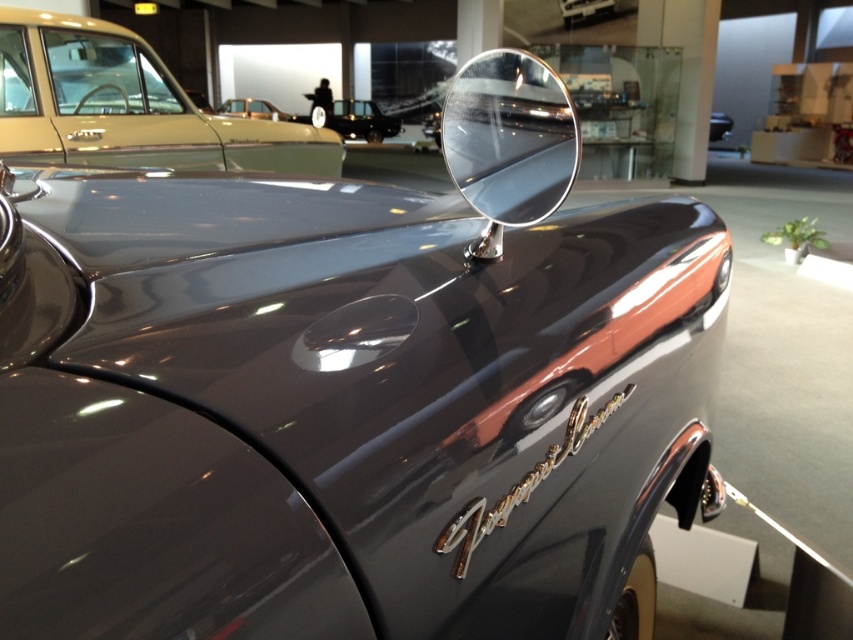
You are a photographer trying to capture both the shiny gold car at upper left and the shiny black car at center in a single frame. Which car should you adjust your camera angle to focus on first to ensure both are in view?

The shiny gold car at upper left is positioned under the shiny black car at center, so you should focus on the shiny black car at center first to ensure both are in view.

In the scene shown: You are a parking attendant who needs to move a car that is 2.5 meters long. You see the shiny gold car at upper left and the gold metallic car at upper center in the parking lot. Can you fit the car between them without moving either vehicle?

The distance between the shiny gold car at upper left and the gold metallic car at upper center is 2.70 meters. Since the car to be parked is 2.5 meters long, there is enough space to fit it between them without moving either vehicle.